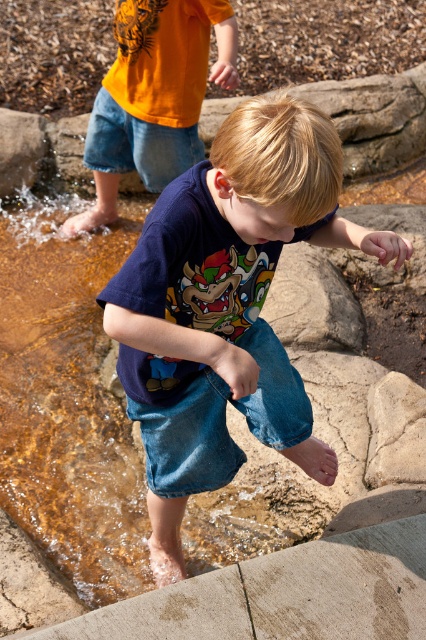
Between blue denim shorts at center and denim jeans at upper center, which one has more height?

With more height is blue denim shorts at center.

Who is more forward, (167, 435) or (149, 180)?

Positioned in front is point (167, 435).

At what (x,y) coordinates should I click in order to perform the action: click on blue denim shorts at center. Please return your answer as a coordinate pair (x, y). Looking at the image, I should click on (226, 307).

Between point (262, 257) and point (252, 342), which one is positioned in front?

Point (262, 257) is in front.

What do you see at coordinates (226, 307) in the screenshot?
I see `blue denim shorts at center` at bounding box center [226, 307].

Is point (256, 248) positioned after point (284, 401)?

No, it is not.

Locate an element on the screen. blue denim shorts at center is located at coordinates (226, 307).

Is denim shorts at upper left closer to camera compared to denim jeans at upper center?

Yes, it is.

Can you confirm if denim shorts at upper left is bigger than denim jeans at upper center?

Indeed, denim shorts at upper left has a larger size compared to denim jeans at upper center.

At what (x,y) coordinates should I click in order to perform the action: click on denim shorts at upper left. Please return your answer as a coordinate pair (x, y). The height and width of the screenshot is (640, 426). Looking at the image, I should click on (154, 97).

Locate an element on the screen. denim shorts at upper left is located at coordinates (154, 97).